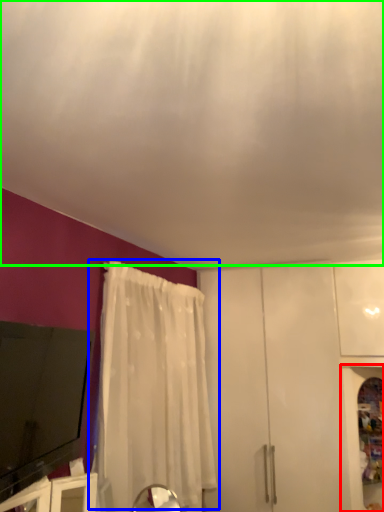
Question: Which object is positioned farthest from cabinetry (highlighted by a red box)? Select from curtain (highlighted by a blue box) and blind (highlighted by a green box).

Choices:
 (A) curtain
 (B) blind

Answer: (B)